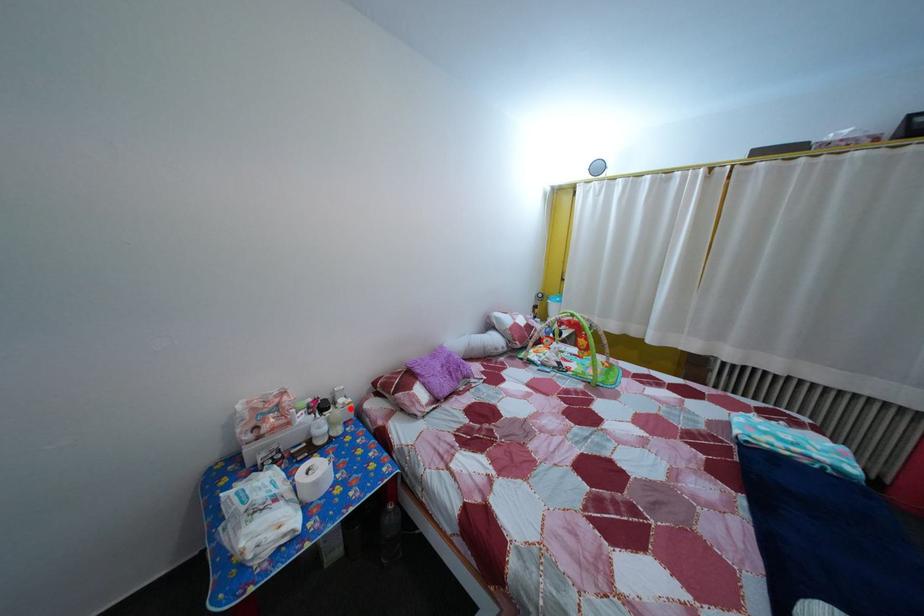
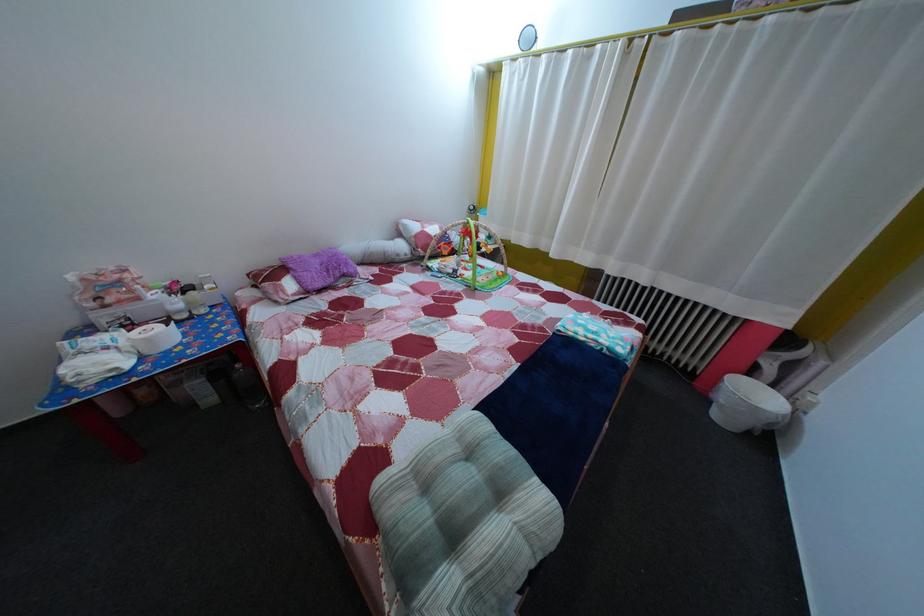
The point at the highlighted location is marked in the first image. Where is the corresponding point in the second image?

(216, 294)